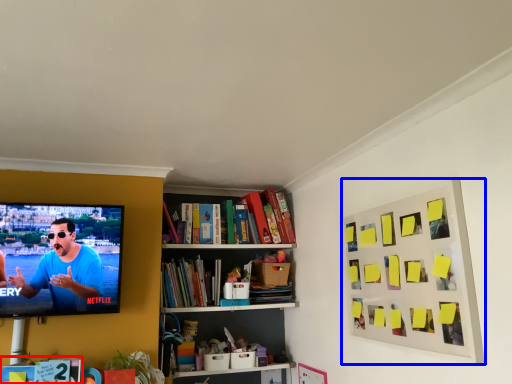
Question: Which object is further to the camera taking this photo, book (highlighted by a red box) or picture frame (highlighted by a blue box)?

Choices:
 (A) book
 (B) picture frame

Answer: (A)